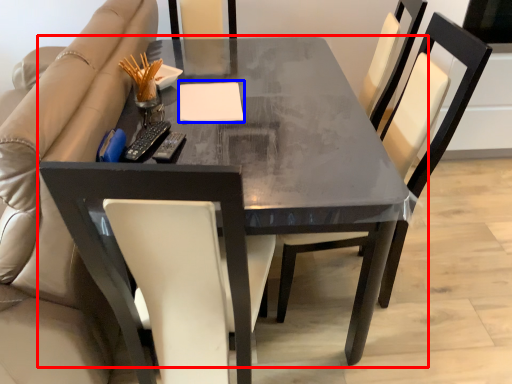
Question: Which object is closer to the camera taking this photo, table (highlighted by a red box) or notepad (highlighted by a blue box)?

Choices:
 (A) table
 (B) notepad

Answer: (A)